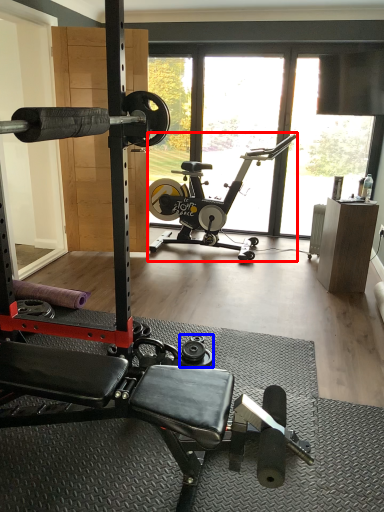
Question: Among these objects, which one is farthest to the camera, stationary bicycle (highlighted by a red box) or dumbbell (highlighted by a blue box)?

Choices:
 (A) stationary bicycle
 (B) dumbbell

Answer: (A)